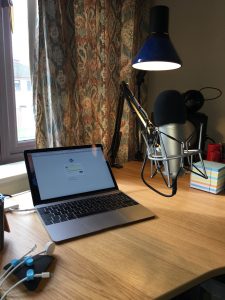
Find the location of a particular element. Image resolution: width=225 pixels, height=300 pixels. woodgrain desktop is located at coordinates (141, 263).